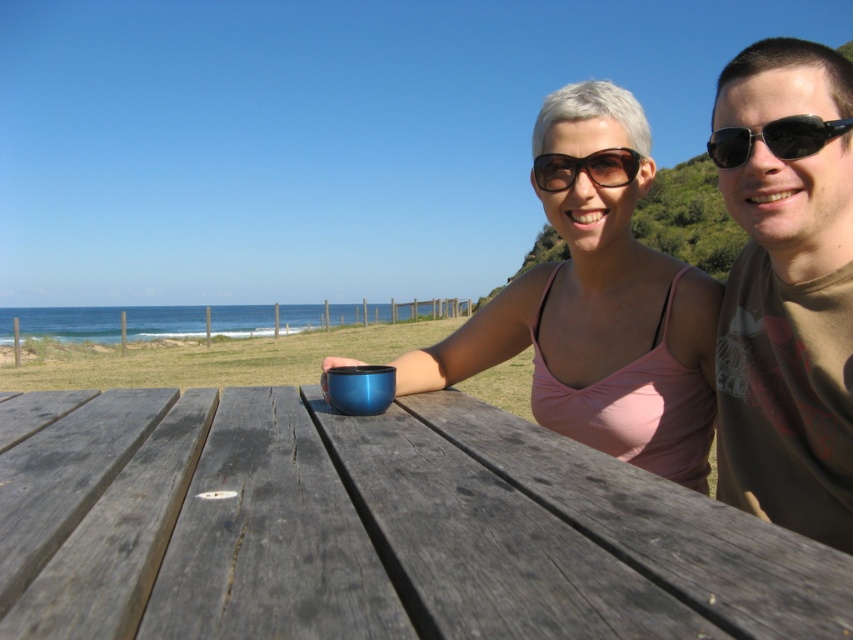
Is brown cotton t-shirt at upper right in front of black plastic sunglasses at upper center?

Yes, it is.

Is brown cotton t-shirt at upper right smaller than black plastic sunglasses at upper center?

No.

Find the location of a particular element. The width and height of the screenshot is (853, 640). brown cotton t-shirt at upper right is located at coordinates point(787,294).

Consider the image. Who is taller, wooden picnic table at center or matte blue cup at center?

matte blue cup at center

Is wooden picnic table at center smaller than matte blue cup at center?

Yes, wooden picnic table at center is smaller than matte blue cup at center.

Does point (73, 632) lie behind point (701, 362)?

No, (73, 632) is closer to viewer.

This screenshot has height=640, width=853. Identify the location of wooden picnic table at center. (378, 529).

How much distance is there between brown cotton t-shirt at upper right and black plastic sunglasses at upper right?

10.00 inches

Between brown cotton t-shirt at upper right and black plastic sunglasses at upper right, which one is positioned higher?

Positioned higher is black plastic sunglasses at upper right.

Does point (782, 413) come closer to viewer compared to point (810, 136)?

No.

This screenshot has height=640, width=853. Find the location of `brown cotton t-shirt at upper right`. brown cotton t-shirt at upper right is located at coordinates (787, 294).